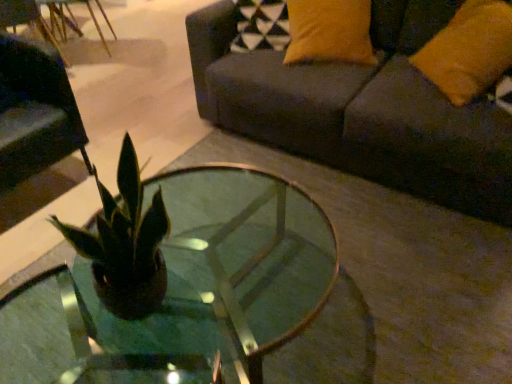
Where is `vacant space to the right of clear glass coffee table at center`? vacant space to the right of clear glass coffee table at center is located at coordinates (410, 290).